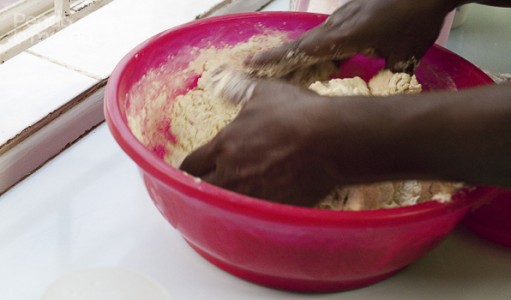
Find the location of a particular element. The image size is (511, 300). bowl is located at coordinates (358, 235).